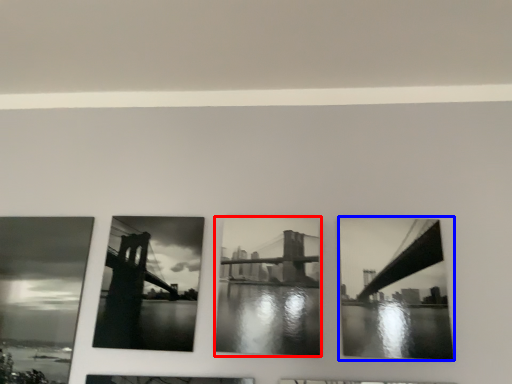
Question: Among these objects, which one is farthest to the camera, picture frame (highlighted by a red box) or picture frame (highlighted by a blue box)?

Choices:
 (A) picture frame
 (B) picture frame

Answer: (A)